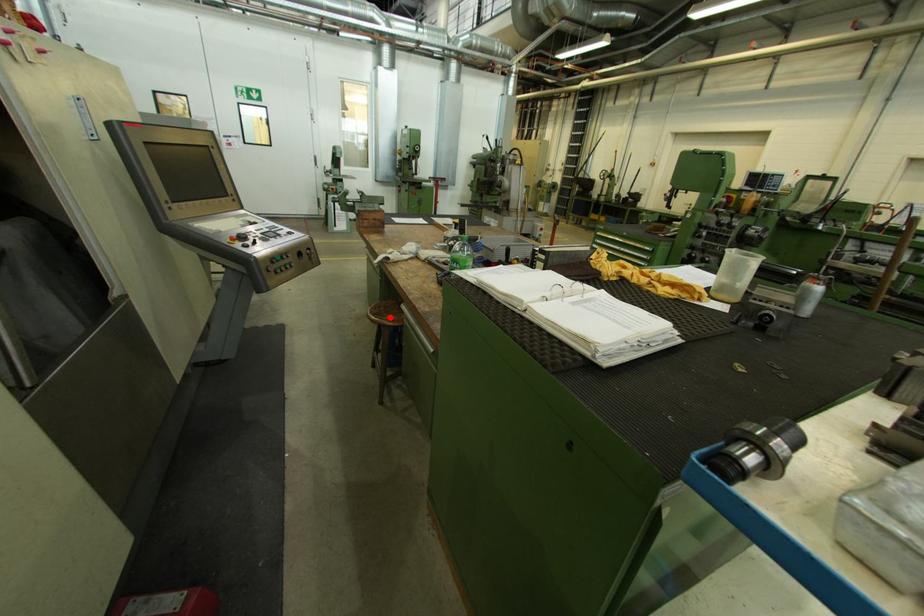
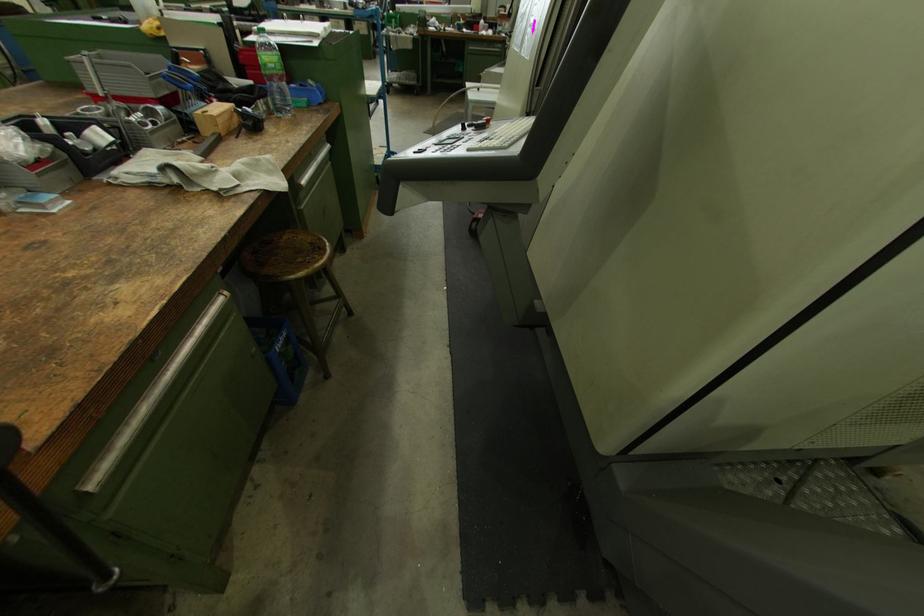
Question: I am providing you with two images of the same scene from different viewpoints. Image1 has a red point marked. In image2, the corresponding 3D location appears at what relative position? Reply with the corresponding letter.

Choices:
 (A) Closer
 (B) Farther

Answer: (A)